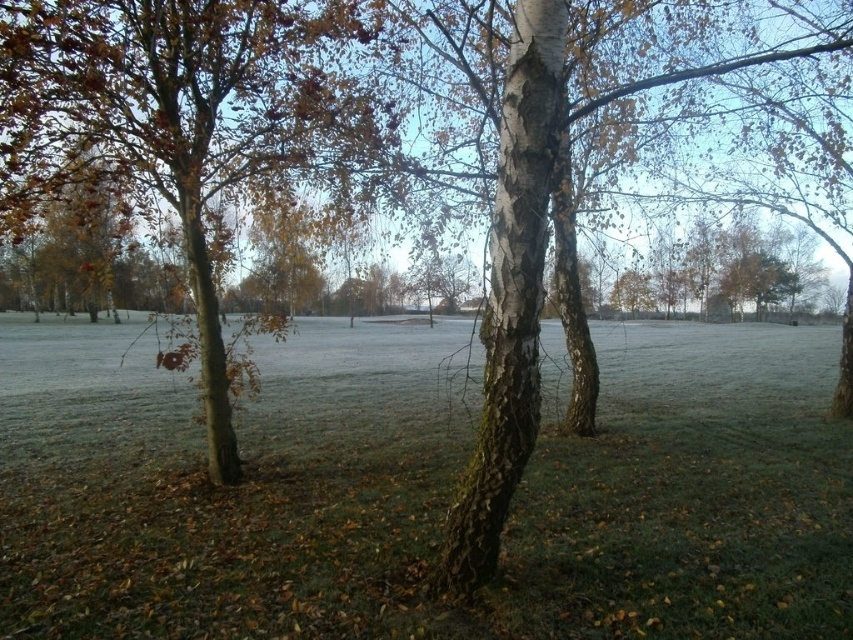
Between point (738, 380) and point (32, 76), which one is positioned behind?

Point (738, 380)

The height and width of the screenshot is (640, 853). Describe the element at coordinates (424, 490) in the screenshot. I see `green grass at center` at that location.

Identify the location of green grass at center. This screenshot has width=853, height=640. (424, 490).